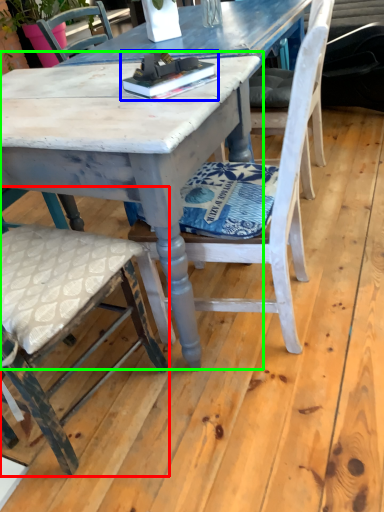
Question: Which is nearer to the chair (highlighted by a red box)? book (highlighted by a blue box) or round table (highlighted by a green box).

Choices:
 (A) book
 (B) round table

Answer: (B)